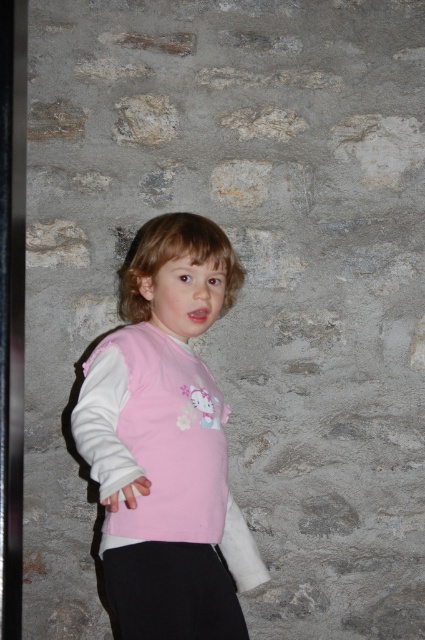
In the scene shown: You are a tailor measuring clothing items for a child. You see the pink fabric shirt at center and the black cotton pants at lower center. Which clothing item is longer in height?

The pink fabric shirt at center is taller than the black cotton pants at lower center, so the pink fabric shirt at center is longer in height.

You are a photographer trying to capture the child in the image. The camera you are using has a focus point at position 0.683, 0.386. Will the pink fabric shirt at center be in focus?

The position of the pink fabric shirt at center is at point (164,436), so yes, the pink fabric shirt at center will be in focus because the camera focus point is exactly at that position.

You are a fashion designer looking at the child in the image. The child is wearing a pink fabric shirt at center and black cotton pants at lower center. Which piece of clothing is positioned to the left?

The pink fabric shirt at center is to the left of the black cotton pants at lower center.